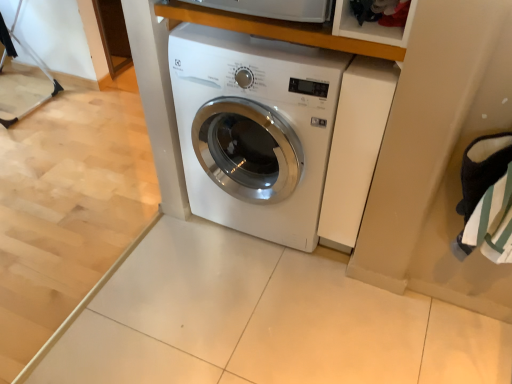
Question: Should I look upward or downward to see white glossy washing machine at center?

Choices:
 (A) up
 (B) down

Answer: (A)

Question: Could you tell me if wooden at upper center is turned towards white glossy washing machine at center?

Choices:
 (A) no
 (B) yes

Answer: (A)

Question: From a real-world perspective, does wooden at upper center sit lower than white glossy washing machine at center?

Choices:
 (A) no
 (B) yes

Answer: (A)

Question: Does wooden at upper center have a larger size compared to white glossy washing machine at center?

Choices:
 (A) no
 (B) yes

Answer: (A)

Question: From a real-world perspective, is wooden at upper center physically above white glossy washing machine at center?

Choices:
 (A) no
 (B) yes

Answer: (B)

Question: Is wooden at upper center positioned in front of white glossy washing machine at center?

Choices:
 (A) no
 (B) yes

Answer: (B)

Question: Is wooden at upper center thinner than white glossy washing machine at center?

Choices:
 (A) no
 (B) yes

Answer: (B)

Question: Could you tell me if white glossy washing machine at center is facing wooden at upper center?

Choices:
 (A) no
 (B) yes

Answer: (A)

Question: Is white glossy washing machine at center wider than wooden at upper center?

Choices:
 (A) yes
 (B) no

Answer: (A)

Question: From the image's perspective, does white glossy washing machine at center appear higher than wooden at upper center?

Choices:
 (A) no
 (B) yes

Answer: (A)

Question: From a real-world perspective, does white glossy washing machine at center sit lower than wooden at upper center?

Choices:
 (A) yes
 (B) no

Answer: (A)

Question: From the image's perspective, is white glossy washing machine at center below wooden at upper center?

Choices:
 (A) yes
 (B) no

Answer: (A)

Question: Does white glossy washing machine at center have a larger size compared to wooden at upper center?

Choices:
 (A) yes
 (B) no

Answer: (A)

Question: Based on their positions, is white glossy washing machine at center located to the left or right of wooden at upper center?

Choices:
 (A) right
 (B) left

Answer: (B)